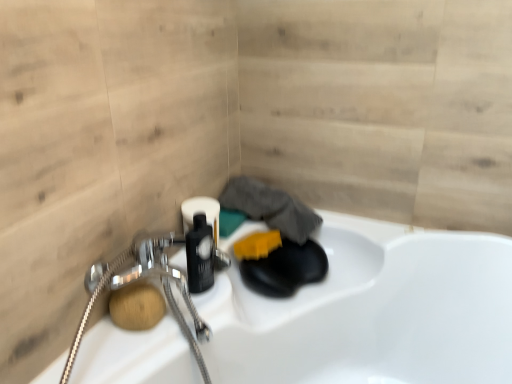
Find the location of a particular element. Image resolution: width=512 pixels, height=384 pixels. yellow sponge at center, marked as the second soap in a front-to-back arrangement is located at coordinates (257, 245).

The width and height of the screenshot is (512, 384). Describe the element at coordinates (257, 245) in the screenshot. I see `yellow sponge at center, the 1th soap positioned from the back` at that location.

How much space does yellow sponge at center, placed as the first soap when sorted from top to bottom, occupy vertically?

yellow sponge at center, placed as the first soap when sorted from top to bottom, is 2.42 inches tall.

Identify the location of natural wood soap at lower left, which is the first soap from front to back. (137, 306).

This screenshot has height=384, width=512. Describe the element at coordinates (137, 306) in the screenshot. I see `natural wood soap at lower left, the 1th soap in the left-to-right sequence` at that location.

At what (x,y) coordinates should I click in order to perform the action: click on yellow sponge at center, which is the 2th soap in left-to-right order. Please return your answer as a coordinate pair (x, y). This screenshot has height=384, width=512. Looking at the image, I should click on (257, 245).

Is natural wood soap at lower left, arranged as the 2th soap when viewed from the top, to the left or to the right of yellow sponge at center, the 1th soap positioned from the back, in the image?

natural wood soap at lower left, arranged as the 2th soap when viewed from the top, is to the left of yellow sponge at center, the 1th soap positioned from the back.

Between natural wood soap at lower left, arranged as the second soap when viewed from the back, and yellow sponge at center, the 1th soap positioned from the back, which one is positioned in front?

Positioned in front is natural wood soap at lower left, arranged as the second soap when viewed from the back.

Does point (159, 306) lie behind point (256, 232)?

No.

From the image's perspective, who appears lower, natural wood soap at lower left, the 1th soap in the left-to-right sequence, or yellow sponge at center, placed as the first soap when sorted from top to bottom?

natural wood soap at lower left, the 1th soap in the left-to-right sequence, is shown below in the image.

From a real-world perspective, is natural wood soap at lower left, which is the first soap from front to back, on yellow sponge at center, the second soap from the bottom?

Indeed, from a real-world perspective, natural wood soap at lower left, which is the first soap from front to back, stands above yellow sponge at center, the second soap from the bottom.

Considering the sizes of objects natural wood soap at lower left, which is the 2th soap from right to left, and yellow sponge at center, marked as the second soap in a front-to-back arrangement, in the image provided, who is thinner, natural wood soap at lower left, which is the 2th soap from right to left, or yellow sponge at center, marked as the second soap in a front-to-back arrangement,?

With smaller width is natural wood soap at lower left, which is the 2th soap from right to left.

Is natural wood soap at lower left, which is the 2th soap from right to left, taller than yellow sponge at center, the second soap from the bottom?

Correct, natural wood soap at lower left, which is the 2th soap from right to left, is much taller as yellow sponge at center, the second soap from the bottom.

Is natural wood soap at lower left, the 1th soap in the left-to-right sequence, bigger or smaller than yellow sponge at center, marked as the second soap in a front-to-back arrangement?

Clearly, natural wood soap at lower left, the 1th soap in the left-to-right sequence, is smaller in size than yellow sponge at center, marked as the second soap in a front-to-back arrangement.

Looking at this image, is natural wood soap at lower left, arranged as the 2th soap when viewed from the top, located outside yellow sponge at center, which is the 2th soap in left-to-right order?

Yes, natural wood soap at lower left, arranged as the 2th soap when viewed from the top, is located beyond the bounds of yellow sponge at center, which is the 2th soap in left-to-right order.

Are natural wood soap at lower left, arranged as the 2th soap when viewed from the top, and yellow sponge at center, marked as the second soap in a front-to-back arrangement, located far from each other?

That's not correct — natural wood soap at lower left, arranged as the 2th soap when viewed from the top, is a little close to yellow sponge at center, marked as the second soap in a front-to-back arrangement.

Is natural wood soap at lower left, which is the first soap from front to back, facing towards yellow sponge at center, which is the 2th soap in left-to-right order?

→ No, natural wood soap at lower left, which is the first soap from front to back, is not facing towards yellow sponge at center, which is the 2th soap in left-to-right order.

How different are the orientations of natural wood soap at lower left, the 1th soap in the left-to-right sequence, and yellow sponge at center, which is the 2th soap in left-to-right order, in degrees?

There is a 0.000544-degree angle between the facing directions of natural wood soap at lower left, the 1th soap in the left-to-right sequence, and yellow sponge at center, which is the 2th soap in left-to-right order.

This screenshot has height=384, width=512. Identify the location of soap below the natural wood soap at lower left, arranged as the 2th soap when viewed from the top (from a real-world perspective). (257, 245).

Would you say yellow sponge at center, which is the 2th soap in left-to-right order, is to the left or to the right of natural wood soap at lower left, which is the first soap in bottom-to-top order, in the picture?

Clearly, yellow sponge at center, which is the 2th soap in left-to-right order, is on the right of natural wood soap at lower left, which is the first soap in bottom-to-top order, in the image.

In the image, is yellow sponge at center, placed as the first soap when sorted from right to left, positioned in front of or behind natural wood soap at lower left, which is the first soap from front to back?

Visually, yellow sponge at center, placed as the first soap when sorted from right to left, is located behind natural wood soap at lower left, which is the first soap from front to back.

Between point (249, 240) and point (109, 303), which one is positioned in front?

Positioned in front is point (109, 303).

Looking at this image, from the image's perspective, between yellow sponge at center, which is the 2th soap in left-to-right order, and natural wood soap at lower left, which is the 2th soap from right to left, who is located below?

natural wood soap at lower left, which is the 2th soap from right to left.

From a real-world perspective, relative to natural wood soap at lower left, arranged as the second soap when viewed from the back, is yellow sponge at center, placed as the first soap when sorted from top to bottom, vertically above or below?

In terms of real-world spatial position, yellow sponge at center, placed as the first soap when sorted from top to bottom, is below natural wood soap at lower left, arranged as the second soap when viewed from the back.

Is yellow sponge at center, the second soap from the bottom, wider than natural wood soap at lower left, which is the 2th soap from right to left?

Indeed, yellow sponge at center, the second soap from the bottom, has a greater width compared to natural wood soap at lower left, which is the 2th soap from right to left.

From the picture: Who is taller, yellow sponge at center, placed as the first soap when sorted from top to bottom, or natural wood soap at lower left, the 1th soap in the left-to-right sequence?

Standing taller between the two is natural wood soap at lower left, the 1th soap in the left-to-right sequence.

Considering the sizes of yellow sponge at center, marked as the second soap in a front-to-back arrangement, and natural wood soap at lower left, arranged as the 2th soap when viewed from the top, in the image, is yellow sponge at center, marked as the second soap in a front-to-back arrangement, bigger or smaller than natural wood soap at lower left, arranged as the 2th soap when viewed from the top,?

Clearly, yellow sponge at center, marked as the second soap in a front-to-back arrangement, is larger in size than natural wood soap at lower left, arranged as the 2th soap when viewed from the top.

Is yellow sponge at center, which is the 2th soap in left-to-right order, surrounding natural wood soap at lower left, which is the first soap in bottom-to-top order?

That's incorrect, natural wood soap at lower left, which is the first soap in bottom-to-top order, is not inside yellow sponge at center, which is the 2th soap in left-to-right order.

Based on the photo, is yellow sponge at center, the second soap from the bottom, beside natural wood soap at lower left, which is the first soap in bottom-to-top order?

No, yellow sponge at center, the second soap from the bottom, is not with natural wood soap at lower left, which is the first soap in bottom-to-top order.

Is yellow sponge at center, marked as the second soap in a front-to-back arrangement, positioned with its back to natural wood soap at lower left, which is the first soap from front to back?

That's not correct — yellow sponge at center, marked as the second soap in a front-to-back arrangement, is not looking away from natural wood soap at lower left, which is the first soap from front to back.

I want to click on soap lying below the yellow sponge at center, placed as the first soap when sorted from top to bottom (from the image's perspective), so click(x=137, y=306).

Locate an element on the screen. Image resolution: width=512 pixels, height=384 pixels. soap on the left of yellow sponge at center, the 1th soap positioned from the back is located at coordinates (137, 306).

I want to click on soap above the yellow sponge at center, placed as the first soap when sorted from top to bottom (from a real-world perspective), so click(137, 306).